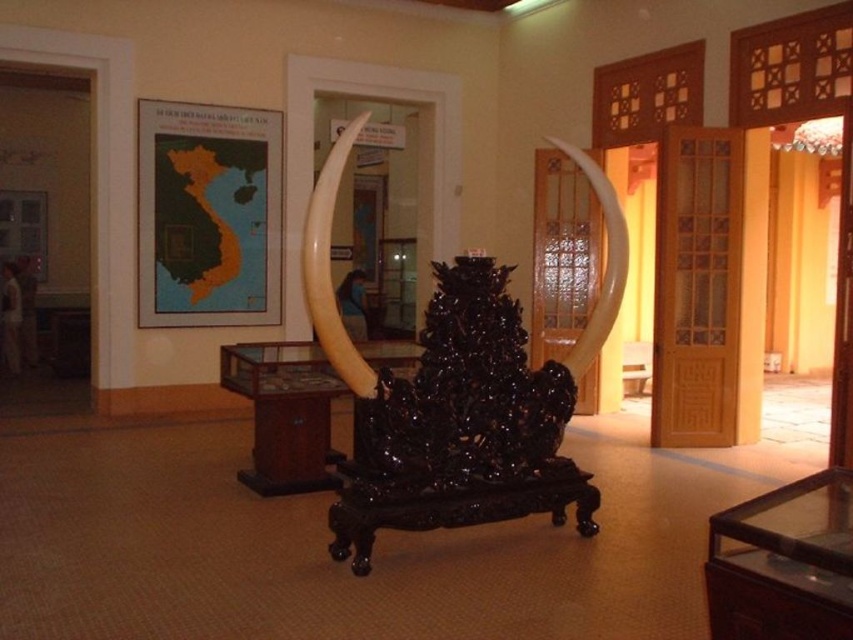
Who is lower down, black polished wood sculpture at center or ivory tusk at center?

Positioned lower is black polished wood sculpture at center.

Who is taller, black polished wood sculpture at center or ivory tusk at center?

With more height is black polished wood sculpture at center.

Is point (537, 436) positioned behind point (341, 157)?

Yes, it is behind point (341, 157).

Identify the location of black polished wood sculpture at center. (457, 392).